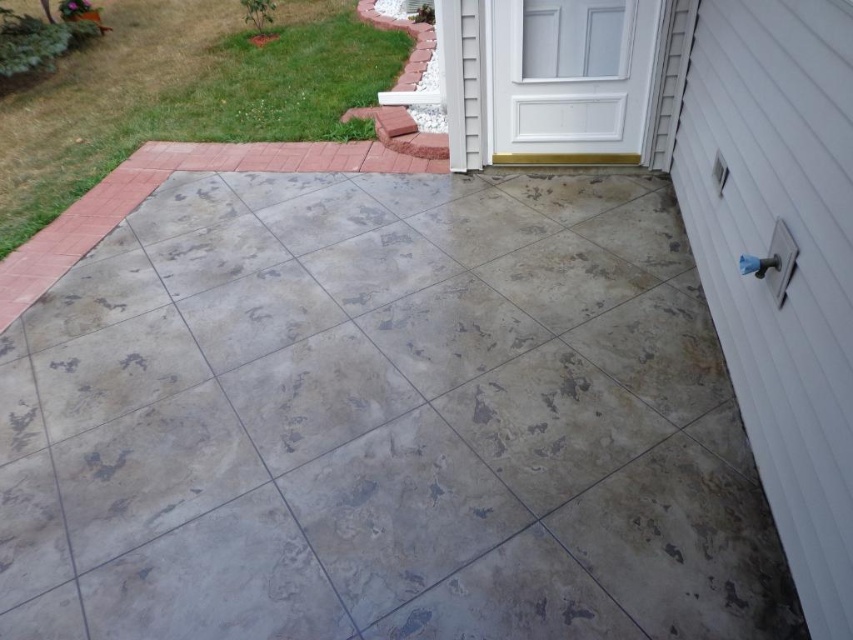
Can you confirm if gray concrete at center is bigger than gray concrete patio at upper left?

Actually, gray concrete at center might be smaller than gray concrete patio at upper left.

Between gray concrete at center and gray concrete patio at upper left, which one has more height?

Standing taller between the two is gray concrete patio at upper left.

Is point (634, 228) more distant than point (198, 54)?

No, it is not.

Identify the location of gray concrete at center. pyautogui.click(x=381, y=422).